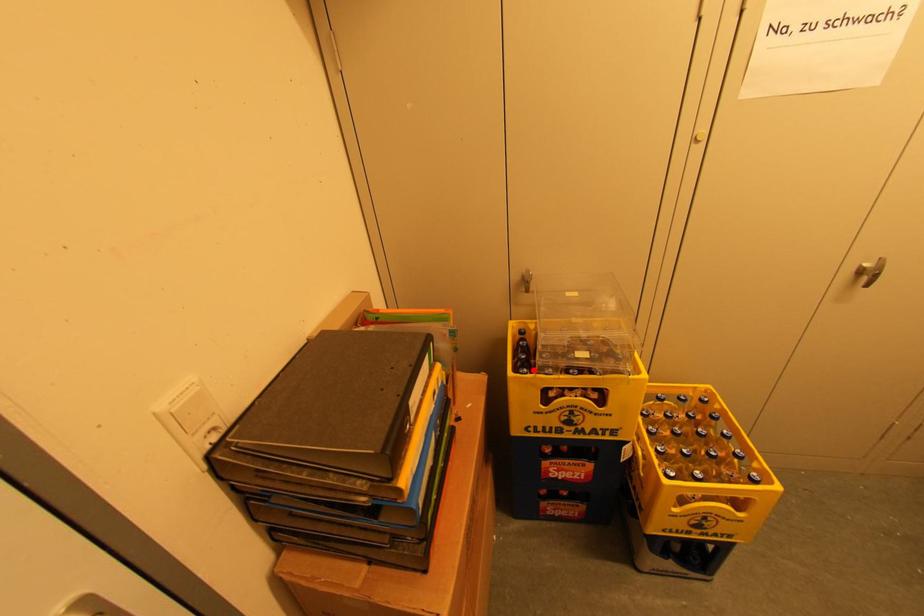
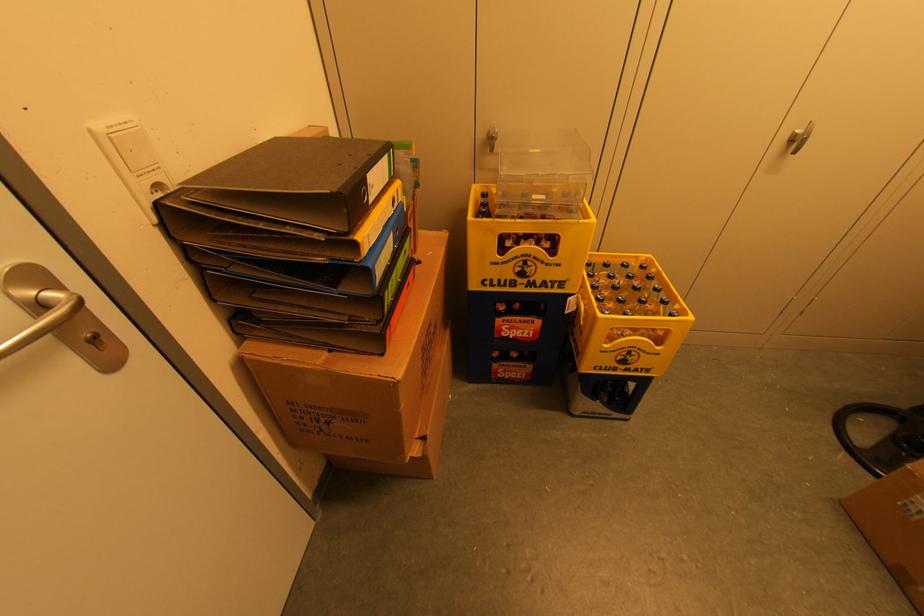
In the second image, find the point that corresponds to the highlighted location in the first image.

(492, 215)